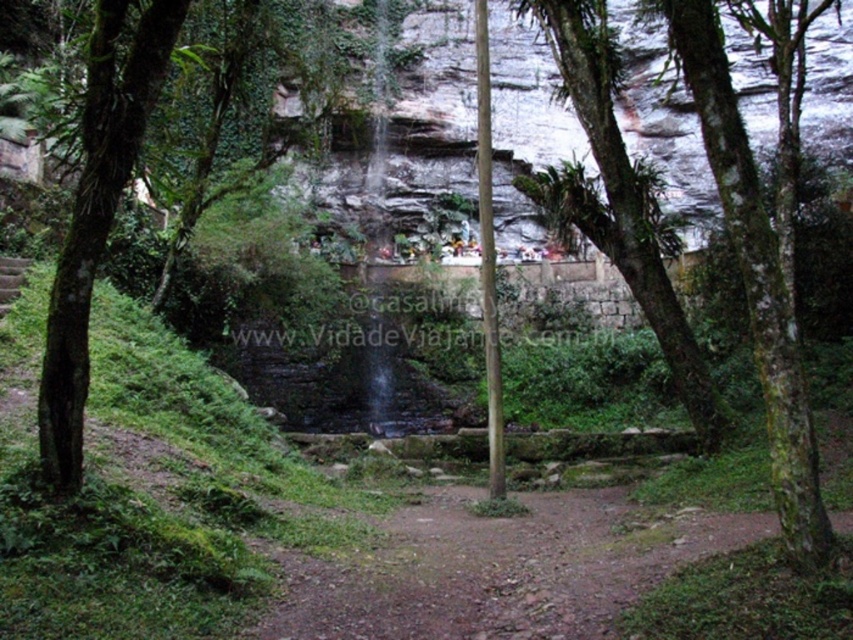
You are a hiker trying to determine which tree to climb for a better view. Based on the image, which tree, the green rough bark tree at left or the green mossy bark tree at center, would you choose and why?

The green mossy bark tree at center is larger than the green rough bark tree at left, so it would provide a more stable and higher vantage point for climbing.

You are standing at the center of the image and want to locate the green mossy tree at center. What are the coordinates where you should look?

The green mossy tree at center is located at coordinates point (618, 202).